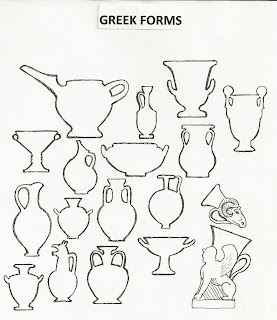
Where is `light gray background color`? The height and width of the screenshot is (320, 277). light gray background color is located at coordinates (120, 54), (151, 295).